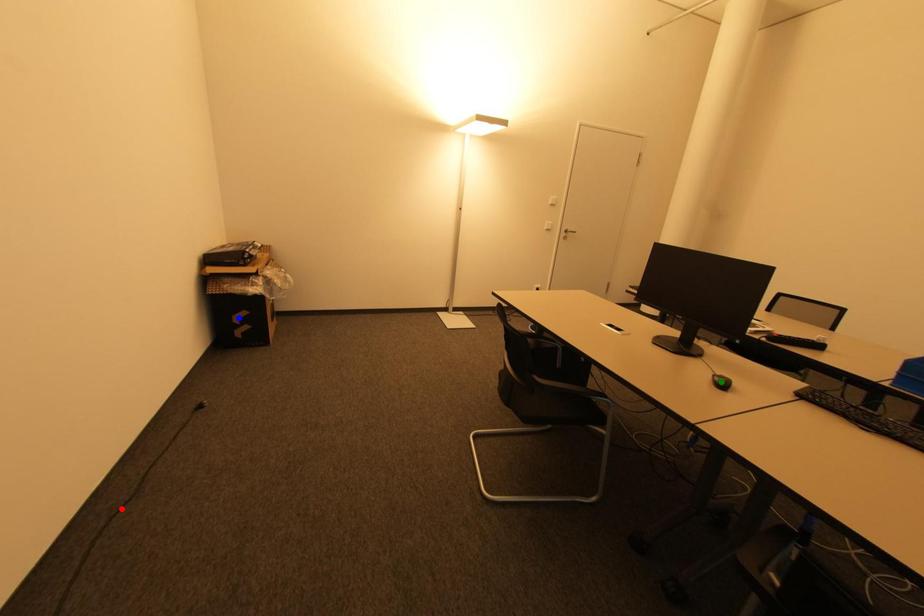
Order these from nearest to farthest:
blue point | red point | green point

green point < red point < blue point